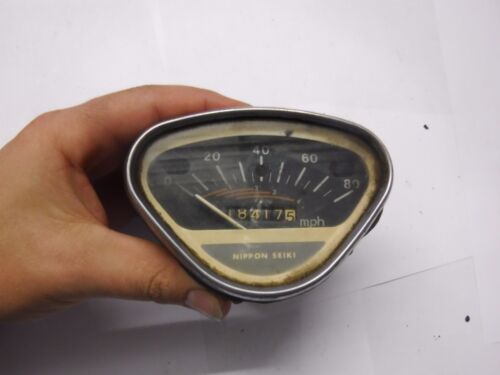
Where is `table`? This screenshot has width=500, height=375. table is located at coordinates (433, 262).